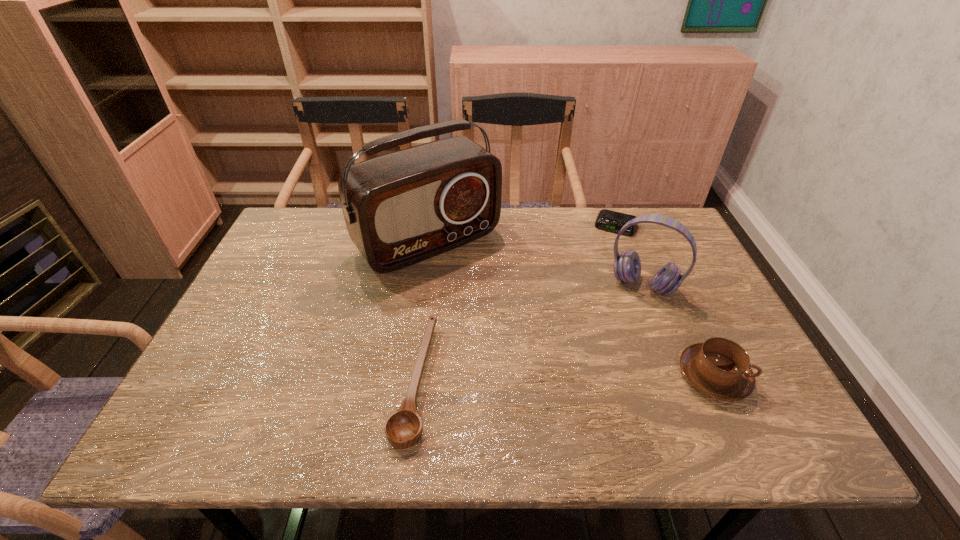
Identify the location of alarm clock positioned at the right edge. The width and height of the screenshot is (960, 540). (608, 220).

Where is `headset that is at the right edge`? Image resolution: width=960 pixels, height=540 pixels. headset that is at the right edge is located at coordinates (627, 267).

Locate an element on the screen. Image resolution: width=960 pixels, height=540 pixels. object that is at the far right corner is located at coordinates (608, 220).

Locate an element on the screen. object located in the near right corner section of the desktop is located at coordinates (719, 368).

Locate an element on the screen. The image size is (960, 540). vacant region at the far edge of the desktop is located at coordinates (324, 251).

The width and height of the screenshot is (960, 540). I want to click on vacant space at the near edge, so click(664, 383).

Image resolution: width=960 pixels, height=540 pixels. Find the location of `vacant space at the left edge`. vacant space at the left edge is located at coordinates (310, 275).

The width and height of the screenshot is (960, 540). In the image, there is a desktop. In order to click on blank space at the right edge in this screenshot , I will do `click(688, 275)`.

Where is `vacant area at the far left corner of the desktop`? vacant area at the far left corner of the desktop is located at coordinates (306, 215).

In the image, there is a desktop. At what (x,y) coordinates should I click in order to perform the action: click on free space at the near left corner. Please return your answer as a coordinate pair (x, y). Looking at the image, I should click on (258, 386).